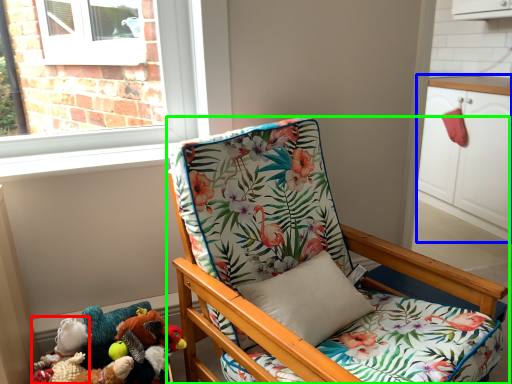
Question: Which object is positioned farthest from toy (highlighted by a red box)? Select from cabinetry (highlighted by a blue box) and chair (highlighted by a green box).

Choices:
 (A) cabinetry
 (B) chair

Answer: (A)